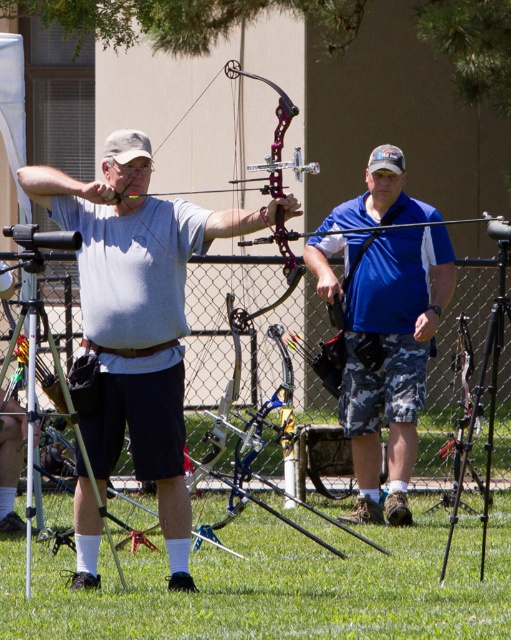
Between matte gray shirt at center and blue/camo shorts at center, which one appears on the left side from the viewer's perspective?

matte gray shirt at center

This screenshot has height=640, width=511. What do you see at coordinates (138, 312) in the screenshot?
I see `matte gray shirt at center` at bounding box center [138, 312].

Find the location of a particular element. matte gray shirt at center is located at coordinates (138, 312).

I want to click on matte gray shirt at center, so [x=138, y=312].